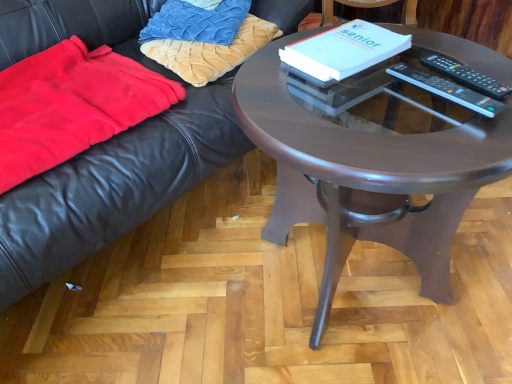
Where is `vacant location behind black plastic remote control at upper right, placed as the 1th remote control when sorted from right to left`? This screenshot has width=512, height=384. vacant location behind black plastic remote control at upper right, placed as the 1th remote control when sorted from right to left is located at coordinates (446, 48).